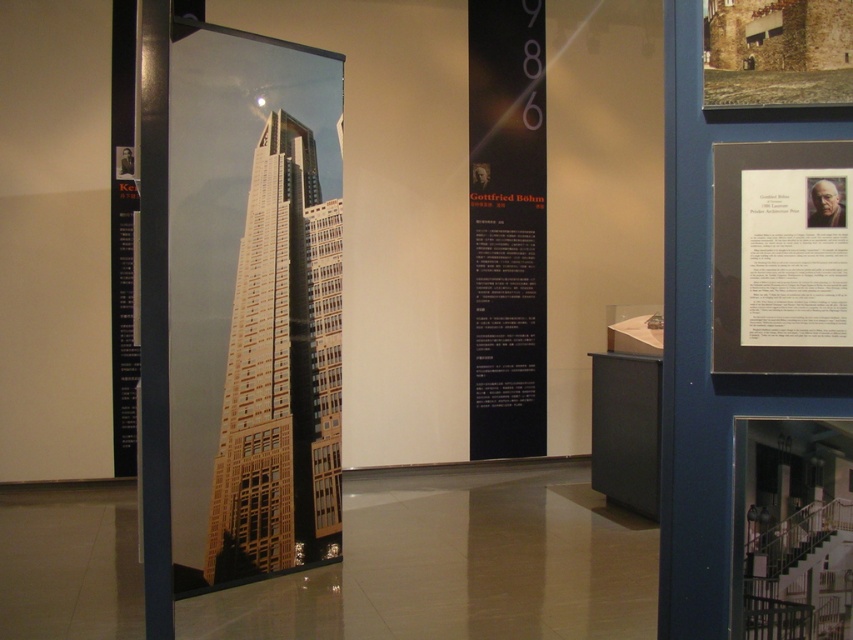
You are an art student visiting the exhibition and want to take a photo of both the matte glass skyscraper at center and the black matte poster at center. Since your camera can only focus on one object at a time, which object should you position closer to the camera first?

You should position the matte glass skyscraper at center closer to the camera first because it is to the left of the black matte poster at center, so it is closer to the camera.

You are an art student who needs to hang a new poster on the wall. You see the black matte poster at center and the white paper at upper right. Which one is taller?

The black matte poster at center is taller than the white paper at upper right.

You are an art student visiting the exhibition and want to sketch the scene. You notice two items of interest. Which one is closer to you, the matte glass skyscraper at center or the white paper at upper right?

The matte glass skyscraper at center is closer to you because the white paper at upper right is behind it.